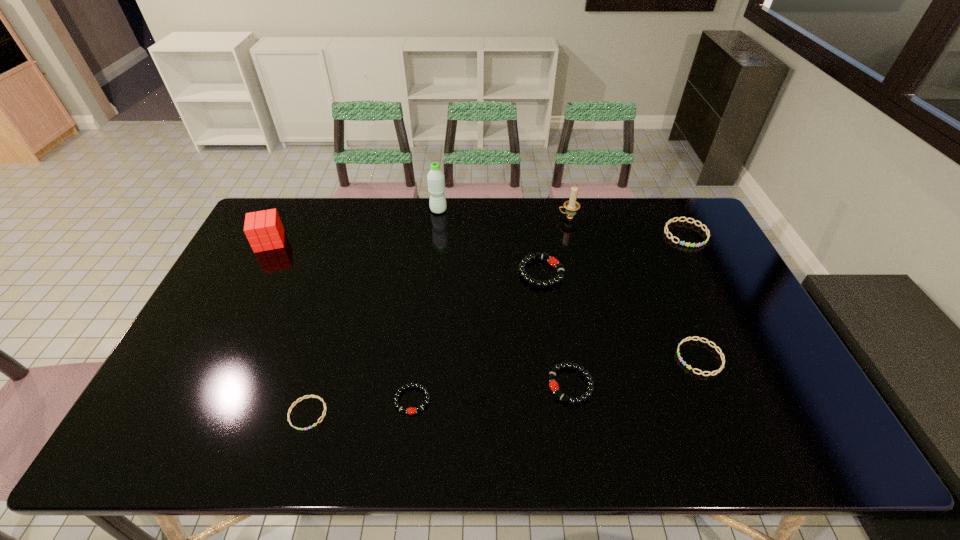
Where is `green water bottle`? This screenshot has height=540, width=960. green water bottle is located at coordinates (436, 179).

I want to click on water bottle, so click(436, 179).

In order to click on candle_holder in this screenshot , I will do `click(571, 206)`.

Where is `cube`? The width and height of the screenshot is (960, 540). cube is located at coordinates (264, 230).

Find the location of a particular element. The height and width of the screenshot is (540, 960). the seventh shortest object is located at coordinates (264, 230).

Identify the location of the biggest black bracelet. This screenshot has width=960, height=540. (552, 261).

Where is `the fifth farthest object`? the fifth farthest object is located at coordinates pos(552,261).

This screenshot has width=960, height=540. Find the location of `the biggest blue bracelet`. the biggest blue bracelet is located at coordinates (672, 237).

Where is `the farthest blue bracelet`? The height and width of the screenshot is (540, 960). the farthest blue bracelet is located at coordinates (672, 237).

The width and height of the screenshot is (960, 540). In order to click on the second smallest black bracelet in this screenshot , I will do `click(553, 384)`.